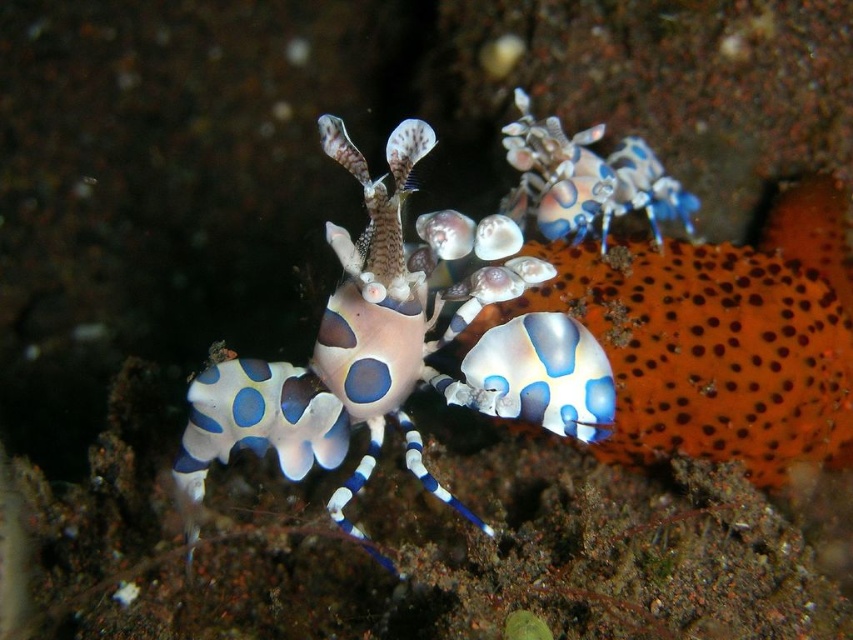
Does point (405, 321) come farther from viewer compared to point (653, 232)?

No, it is not.

Between point (397, 337) and point (524, 179), which one is positioned in front?

Point (397, 337) is more forward.

I want to click on translucent blue and white spotted shrimp at center, so click(398, 348).